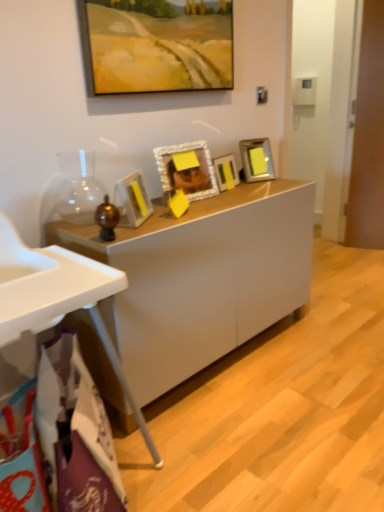
Question: Which direction should I rotate to look at matte yellow picture frame at center, which is the first picture frame in bottom-to-top order, — up or down?

Choices:
 (A) down
 (B) up

Answer: (B)

Question: Is matte yellow picture frame at center, which appears as the 5th picture frame when viewed from the top, looking in the opposite direction of metallic silver picture frame at center-right, acting as the 2th picture frame starting from the top?

Choices:
 (A) yes
 (B) no

Answer: (B)

Question: Can you confirm if matte yellow picture frame at center, which is the first picture frame in bottom-to-top order, is positioned to the left of metallic silver picture frame at center-right, acting as the 4th picture frame starting from the bottom?

Choices:
 (A) yes
 (B) no

Answer: (A)

Question: Is matte yellow picture frame at center, which is the first picture frame in bottom-to-top order, outside of metallic silver picture frame at center-right, acting as the 4th picture frame starting from the bottom?

Choices:
 (A) yes
 (B) no

Answer: (A)

Question: Is matte yellow picture frame at center, which appears as the 5th picture frame when viewed from the top, closer to camera compared to metallic silver picture frame at center-right, acting as the 2th picture frame starting from the top?

Choices:
 (A) no
 (B) yes

Answer: (B)

Question: Does matte yellow picture frame at center, which appears as the 5th picture frame when viewed from the top, have a lesser height compared to metallic silver picture frame at center-right, acting as the 4th picture frame starting from the bottom?

Choices:
 (A) no
 (B) yes

Answer: (B)

Question: Is matte yellow picture frame at center, which appears as the 5th picture frame when viewed from the top, positioned far away from metallic silver picture frame at center-right, acting as the 4th picture frame starting from the bottom?

Choices:
 (A) no
 (B) yes

Answer: (A)

Question: Is white textured picture frame at center, which ranks as the second picture frame in bottom-to-top order, a part of matte yellow picture frame at center, which is the first picture frame in bottom-to-top order?

Choices:
 (A) no
 (B) yes

Answer: (A)

Question: Is matte yellow picture frame at center, which is the first picture frame in bottom-to-top order, in front of white textured picture frame at center, which ranks as the second picture frame in bottom-to-top order?

Choices:
 (A) yes
 (B) no

Answer: (A)

Question: Are matte yellow picture frame at center, which appears as the 5th picture frame when viewed from the top, and white textured picture frame at center, which ranks as the second picture frame in bottom-to-top order, far apart?

Choices:
 (A) no
 (B) yes

Answer: (A)

Question: Is matte yellow picture frame at center, which appears as the 5th picture frame when viewed from the top, next to white textured picture frame at center, placed as the 4th picture frame when sorted from top to bottom?

Choices:
 (A) no
 (B) yes

Answer: (A)

Question: Considering the relative positions of matte yellow picture frame at center, which is the first picture frame in bottom-to-top order, and white textured picture frame at center, which ranks as the second picture frame in bottom-to-top order, in the image provided, is matte yellow picture frame at center, which is the first picture frame in bottom-to-top order, to the left of white textured picture frame at center, which ranks as the second picture frame in bottom-to-top order, from the viewer's perspective?

Choices:
 (A) yes
 (B) no

Answer: (A)

Question: From the image's perspective, would you say matte yellow picture frame at center, which is the first picture frame in bottom-to-top order, is positioned over white textured picture frame at center, which ranks as the second picture frame in bottom-to-top order?

Choices:
 (A) yes
 (B) no

Answer: (B)

Question: Is white glossy cabinet at center facing away from white plastic high chair at lower left?

Choices:
 (A) no
 (B) yes

Answer: (A)